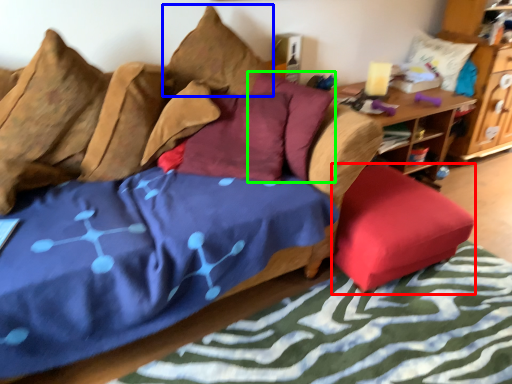
Question: Which is nearer to the chair (highlighted by a red box)? pillow (highlighted by a blue box) or pillow (highlighted by a green box).

Choices:
 (A) pillow
 (B) pillow

Answer: (B)